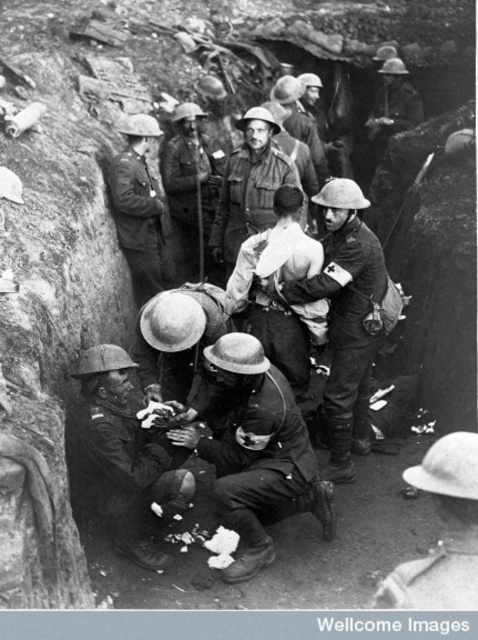
You are a soldier in the trench and need to quickly identify which item is smaller between the light brown leather jacket at center and the matte khaki uniform at center. Which one should you choose?

The light brown leather jacket at center is smaller than the matte khaki uniform at center, so you should choose the light brown leather jacket at center.